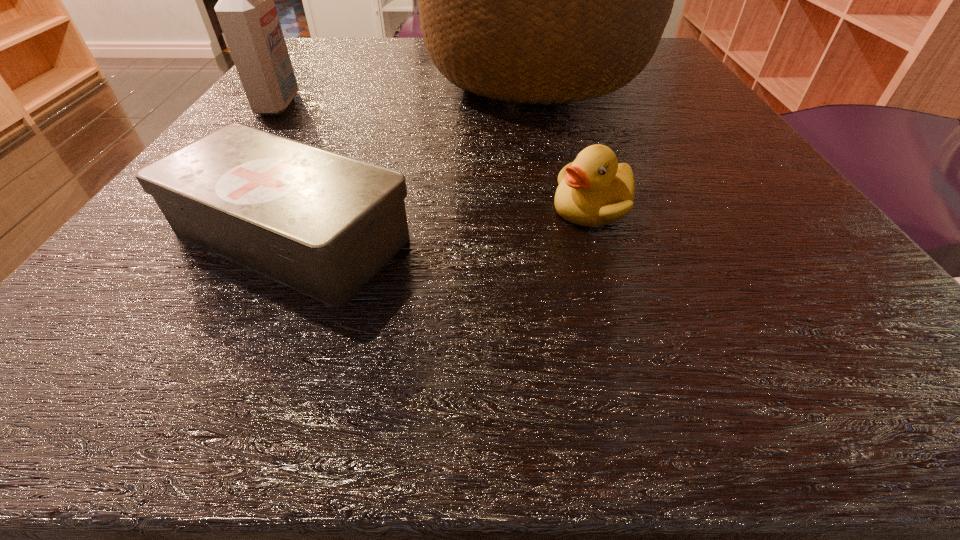
Locate which object ranks in proximity to the basket. Please provide its 2D coordinates. Your answer should be formatted as a tuple, i.e. [(x, y)], where the tuple contains the x and y coordinates of a point satisfying the conditions above.

[(324, 224)]